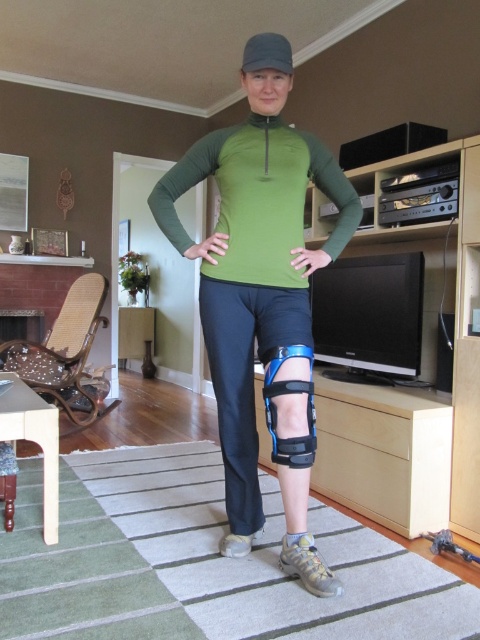
Question: Is green matte knee brace at center to the left of blue plastic knee pad at center from the viewer's perspective?

Choices:
 (A) yes
 (B) no

Answer: (A)

Question: Which point appears closest to the camera in this image?

Choices:
 (A) click(x=288, y=534)
 (B) click(x=263, y=358)

Answer: (B)

Question: Observing the image, what is the correct spatial positioning of green matte knee brace at center in reference to blue plastic knee pad at center?

Choices:
 (A) above
 (B) below

Answer: (A)

Question: Which object is closer to the camera taking this photo?

Choices:
 (A) matte gray shoe at lower center
 (B) green matte knee brace at center
 (C) blue plastic knee pad at center

Answer: (C)

Question: Based on their relative distances, which object is farther from the matte gray shoe at lower center?

Choices:
 (A) blue plastic knee pad at center
 (B) green matte knee brace at center

Answer: (B)

Question: Can you confirm if blue plastic knee pad at center is positioned above matte gray shoe at lower center?

Choices:
 (A) yes
 (B) no

Answer: (A)